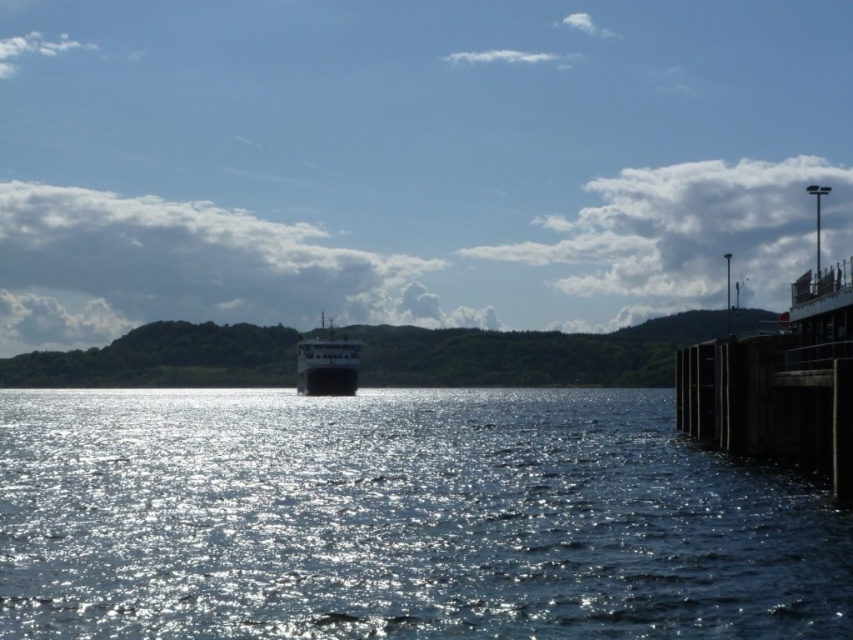
You are a sailor on a small boat that is 5 meters long. You want to navigate between the shiny reflective water at center and the shiny black ship at center. Can your boat fit through the gap between them?

The gap between the shiny reflective water at center and the shiny black ship at center is 36.85 meters. Since your boat is only 5 meters long, it can easily fit through the gap as the distance is much larger than the boat.

You are a photographer trying to capture the reflection of the ferry boat on the shiny reflective water at center. According to the coordinates provided, where should you position your camera to ensure the ferry boat is fully reflected in the water?

The shiny reflective water at center is located at coordinates point (x=399, y=518), so positioning the camera at that point will ensure the ferry boat is fully reflected in the water.